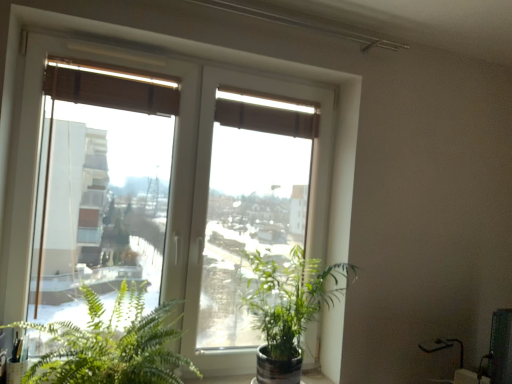
Question: From a real-world perspective, is transparent glass window at center positioned above or below green leafy plant at lower left, positioned as the first houseplant in left-to-right order?

Choices:
 (A) above
 (B) below

Answer: (A)

Question: Is point (145, 140) closer or farther from the camera than point (91, 307)?

Choices:
 (A) farther
 (B) closer

Answer: (A)

Question: Which object is positioned closest to the green leafy plant at lower left, the second houseplant viewed from the right?

Choices:
 (A) brown fabric curtain at upper center
 (B) green glossy plant at center, the 1th houseplant when ordered from right to left
 (C) transparent glass window at center

Answer: (C)

Question: Which of these objects is positioned farthest from the transparent glass window at center?

Choices:
 (A) green glossy plant at center, the 1th houseplant when ordered from right to left
 (B) brown fabric curtain at upper center
 (C) green leafy plant at lower left, positioned as the first houseplant in left-to-right order

Answer: (B)